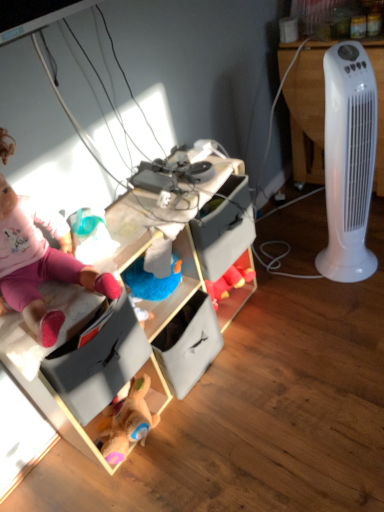
Where is `free space in front of wooden toy storage at center`? free space in front of wooden toy storage at center is located at coordinates (230, 450).